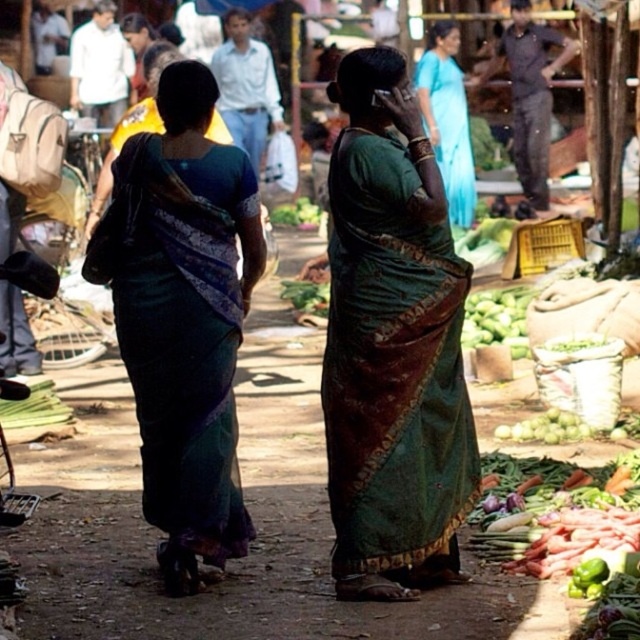
Looking at this image, you are a tailor who needs to determine which saree requires more fabric to cover a mannequin. Based on the image, which saree between the green silk saree at center and the blue silk saree at center would need more fabric?

The blue silk saree at center requires more fabric because it occupies more space than the green silk saree at center.